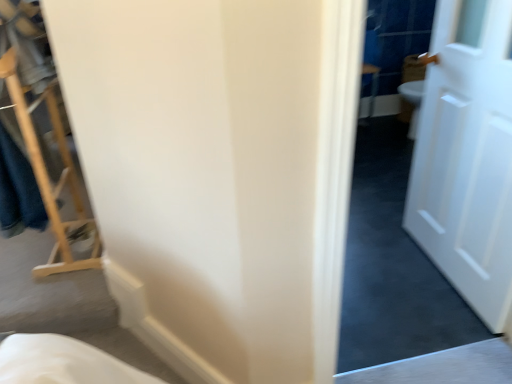
The width and height of the screenshot is (512, 384). What do you see at coordinates (467, 155) in the screenshot? I see `white matte door at right` at bounding box center [467, 155].

You are a GUI agent. You are given a task and a screenshot of the screen. Output one action in this format:
    pyautogui.click(x=<x>, y=<y>)
    Task: Click on the white matte door at right
    This screenshot has height=384, width=512.
    Given the screenshot: What is the action you would take?
    467,155

The image size is (512, 384). Find the location of `white matte door at right`. white matte door at right is located at coordinates (467, 155).